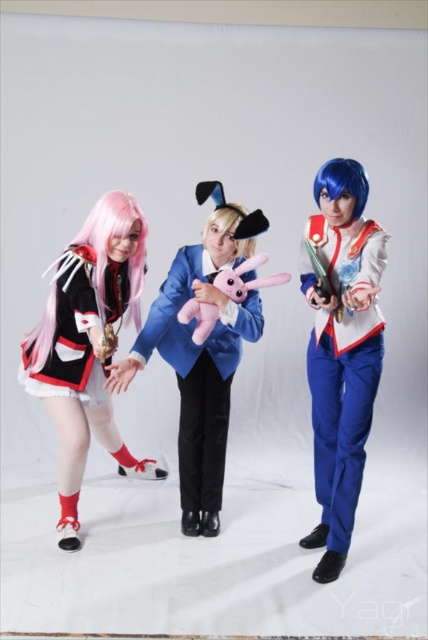
Between shiny blue fabric uniform at right and matte black dress at left, which one has more height?

Standing taller between the two is shiny blue fabric uniform at right.

Which is above, shiny blue fabric uniform at right or matte black dress at left?

matte black dress at left

Image resolution: width=428 pixels, height=640 pixels. I want to click on shiny blue fabric uniform at right, so click(x=342, y=364).

Consider the image. Who is lower down, matte pink plush at left or blue matte wig at right?

matte pink plush at left

In the scene shown: Can you confirm if matte pink plush at left is thinner than blue matte wig at right?

No, matte pink plush at left is not thinner than blue matte wig at right.

Which is in front, point (109, 193) or point (353, 188)?

Point (353, 188) is in front.

I want to click on matte pink plush at left, so click(x=88, y=346).

Describe the element at coordinates (70, 336) in the screenshot. Image resolution: width=428 pixels, height=640 pixels. I see `matte black dress at left` at that location.

Describe the element at coordinates (70, 336) in the screenshot. I see `matte black dress at left` at that location.

You are a GUI agent. You are given a task and a screenshot of the screen. Output one action in this format:
    pyautogui.click(x=<x>, y=<y>)
    Task: Click on the matte black dress at left
    Image resolution: width=428 pixels, height=640 pixels.
    Given the screenshot: What is the action you would take?
    pos(70,336)